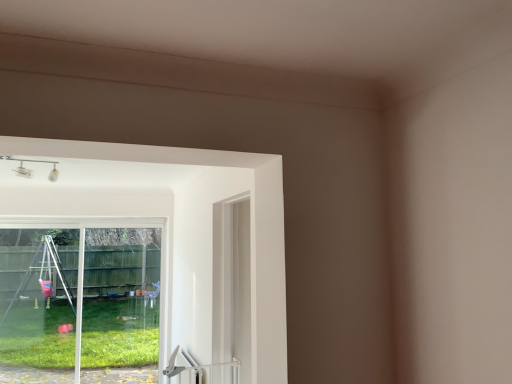
Question: Is white plastic door handle at lower center located outside transparent glass window at lower left?

Choices:
 (A) yes
 (B) no

Answer: (A)

Question: Could you tell me if white plastic door handle at lower center is facing transparent glass window at lower left?

Choices:
 (A) no
 (B) yes

Answer: (A)

Question: Is white plastic door handle at lower center bigger than transparent glass window at lower left?

Choices:
 (A) yes
 (B) no

Answer: (B)

Question: Considering the relative sizes of white plastic door handle at lower center and transparent glass window at lower left in the image provided, is white plastic door handle at lower center taller than transparent glass window at lower left?

Choices:
 (A) no
 (B) yes

Answer: (A)

Question: Does white plastic door handle at lower center lie in front of transparent glass window at lower left?

Choices:
 (A) no
 (B) yes

Answer: (B)

Question: Is white plastic door handle at lower center at the left side of transparent glass window at lower left?

Choices:
 (A) yes
 (B) no

Answer: (B)

Question: Is transparent glass window at lower left further to the viewer compared to white plastic door handle at lower center?

Choices:
 (A) no
 (B) yes

Answer: (B)

Question: Is transparent glass window at lower left at the left side of white plastic door handle at lower center?

Choices:
 (A) no
 (B) yes

Answer: (B)

Question: From a real-world perspective, is transparent glass window at lower left on white plastic door handle at lower center?

Choices:
 (A) no
 (B) yes

Answer: (B)

Question: From the image's perspective, does transparent glass window at lower left appear higher than white plastic door handle at lower center?

Choices:
 (A) yes
 (B) no

Answer: (A)

Question: Is transparent glass window at lower left bigger than white plastic door handle at lower center?

Choices:
 (A) yes
 (B) no

Answer: (A)

Question: Can you confirm if transparent glass window at lower left is wider than white plastic door handle at lower center?

Choices:
 (A) yes
 (B) no

Answer: (B)

Question: Considering the positions of transparent glass window at lower left and white plastic door handle at lower center in the image, is transparent glass window at lower left bigger or smaller than white plastic door handle at lower center?

Choices:
 (A) big
 (B) small

Answer: (A)